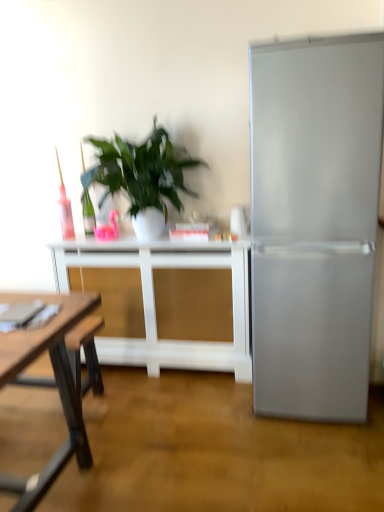
Question: From a real-world perspective, is white matte table at center under satin silver refrigerator at right?

Choices:
 (A) yes
 (B) no

Answer: (A)

Question: Is white matte table at center to the left of satin silver refrigerator at right from the viewer's perspective?

Choices:
 (A) yes
 (B) no

Answer: (A)

Question: Considering the relative sizes of white matte table at center and satin silver refrigerator at right in the image provided, is white matte table at center smaller than satin silver refrigerator at right?

Choices:
 (A) no
 (B) yes

Answer: (B)

Question: Is white matte table at center further to the viewer compared to satin silver refrigerator at right?

Choices:
 (A) no
 (B) yes

Answer: (B)

Question: Considering the relative sizes of white matte table at center and satin silver refrigerator at right in the image provided, is white matte table at center shorter than satin silver refrigerator at right?

Choices:
 (A) yes
 (B) no

Answer: (A)

Question: Is the depth of white matte table at center less than that of satin silver refrigerator at right?

Choices:
 (A) no
 (B) yes

Answer: (A)

Question: Is green leafy plant at center not close to satin silver refrigerator at right?

Choices:
 (A) yes
 (B) no

Answer: (B)

Question: Is green leafy plant at center taller than satin silver refrigerator at right?

Choices:
 (A) no
 (B) yes

Answer: (A)

Question: Is green leafy plant at center not within satin silver refrigerator at right?

Choices:
 (A) yes
 (B) no

Answer: (A)

Question: From the image's perspective, would you say green leafy plant at center is shown under satin silver refrigerator at right?

Choices:
 (A) no
 (B) yes

Answer: (A)

Question: Is green leafy plant at center further to camera compared to satin silver refrigerator at right?

Choices:
 (A) no
 (B) yes

Answer: (B)

Question: Is green leafy plant at center at the left side of satin silver refrigerator at right?

Choices:
 (A) yes
 (B) no

Answer: (A)

Question: Is white matte table at center located within satin silver refrigerator at right?

Choices:
 (A) no
 (B) yes

Answer: (A)